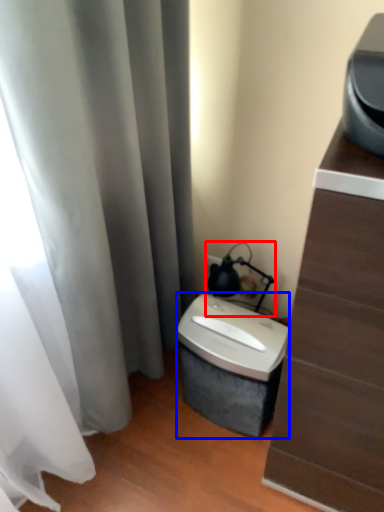
Question: Which object is further to the camera taking this photo, table lamp (highlighted by a red box) or appliance (highlighted by a blue box)?

Choices:
 (A) table lamp
 (B) appliance

Answer: (A)